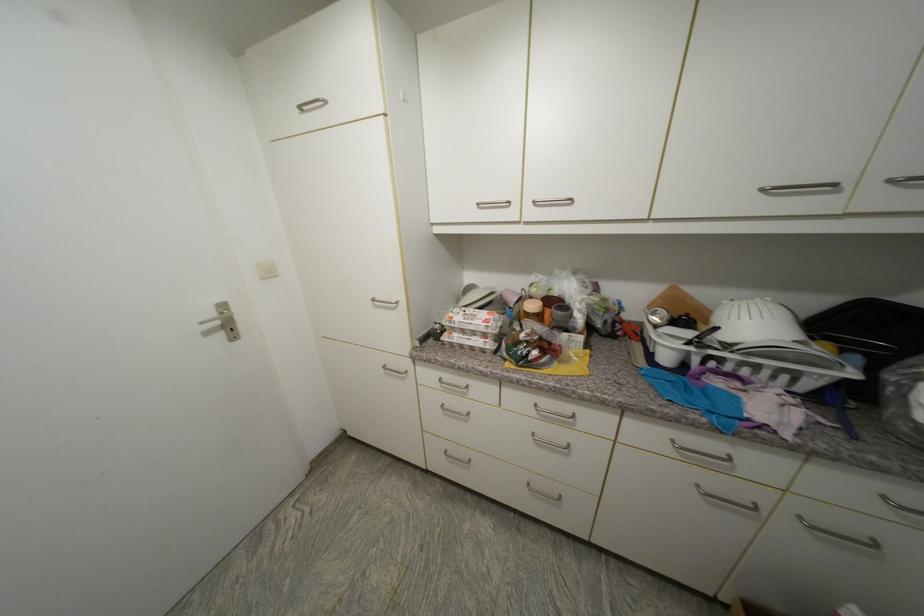
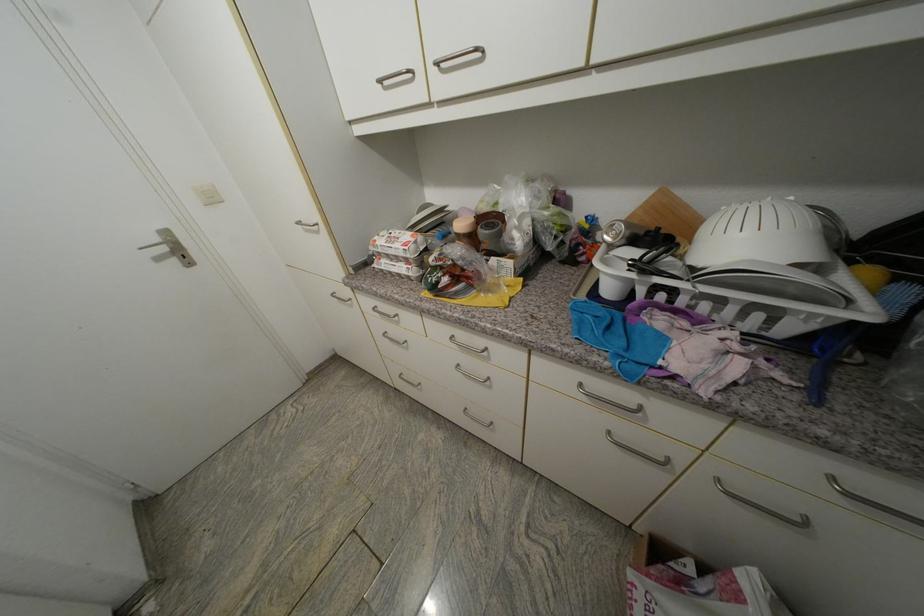
Question: The first image is from the beginning of the video and the second image is from the end. How did the camera likely rotate when shooting the video?

Choices:
 (A) Left
 (B) Right
 (C) Up
 (D) Down

Answer: (D)